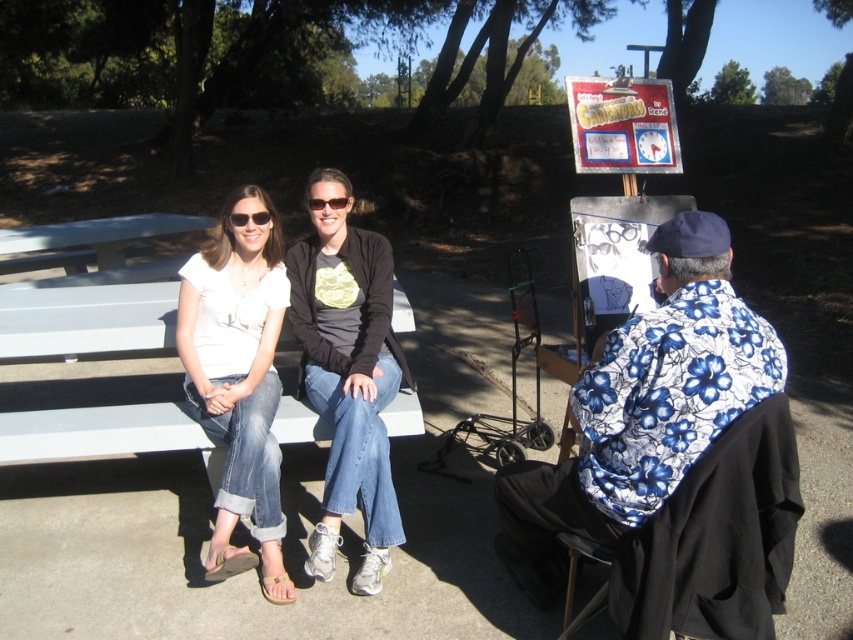
Who is more forward, [592,403] or [245,401]?

Point [592,403]

Can you confirm if blue floral shirt at right is bigger than white cotton shirt at left?

Correct, blue floral shirt at right is larger in size than white cotton shirt at left.

Describe the element at coordinates (642, 406) in the screenshot. I see `blue floral shirt at right` at that location.

I want to click on blue floral shirt at right, so click(x=642, y=406).

Is point (686, 248) farther from viewer compared to point (331, 259)?

No, it is in front of (331, 259).

Is blue floral shirt at right taller than denim jeans at center?

Incorrect, blue floral shirt at right's height is not larger of denim jeans at center's.

Is point (619, 497) in front of point (323, 570)?

Yes, point (619, 497) is in front of point (323, 570).

Locate an element on the screen. This screenshot has width=853, height=640. blue floral shirt at right is located at coordinates (642, 406).

Is point (329, 577) closer to viewer compared to point (256, 509)?

Yes, it is.

Is the position of denim jeans at center less distant than that of white cotton shirt at left?

No, it is behind white cotton shirt at left.

Is point (384, 465) in front of point (279, 273)?

That is True.

At what (x,y) coordinates should I click in order to perform the action: click on denim jeans at center. Please return your answer as a coordinate pair (x, y). Looking at the image, I should click on (347, 372).